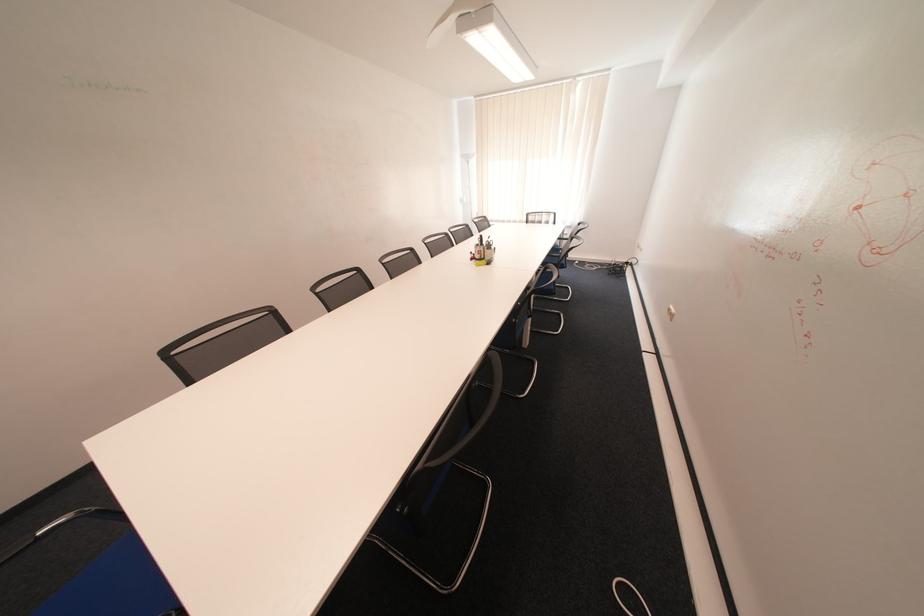
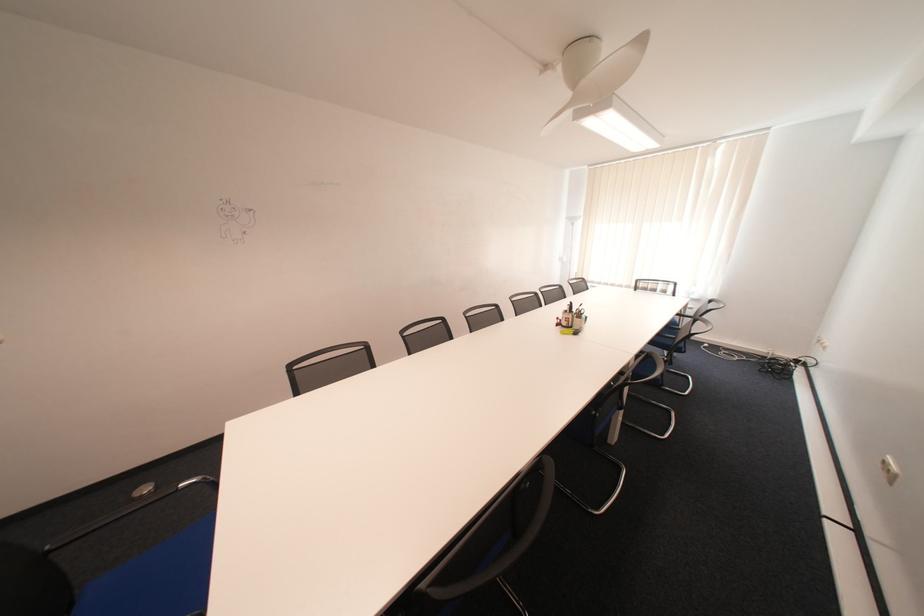
In the second image, find the point that corresponds to (489,245) in the first image.

(578, 312)